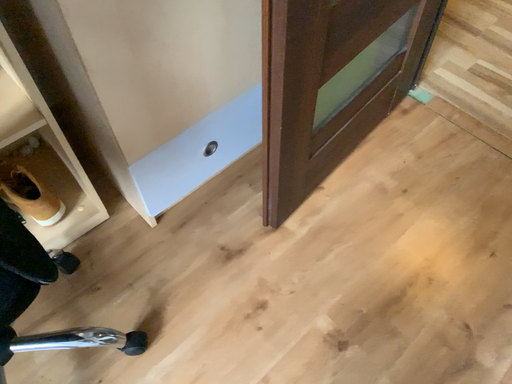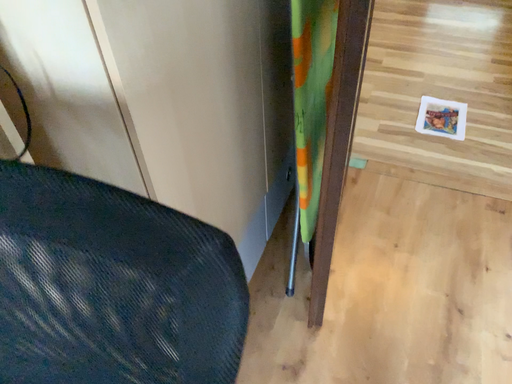
Question: Which way did the camera rotate in the video?

Choices:
 (A) rotated downward
 (B) rotated upward

Answer: (B)